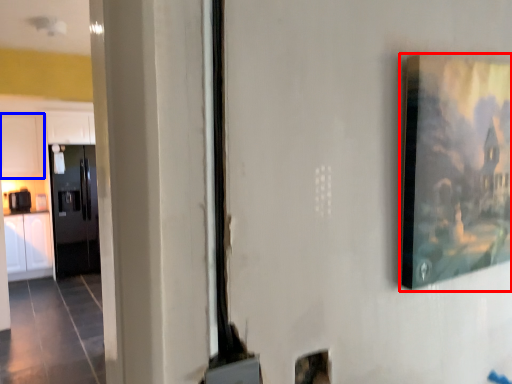
Question: Among these objects, which one is nearest to the camera, picture frame (highlighted by a red box) or cabinetry (highlighted by a blue box)?

Choices:
 (A) picture frame
 (B) cabinetry

Answer: (A)